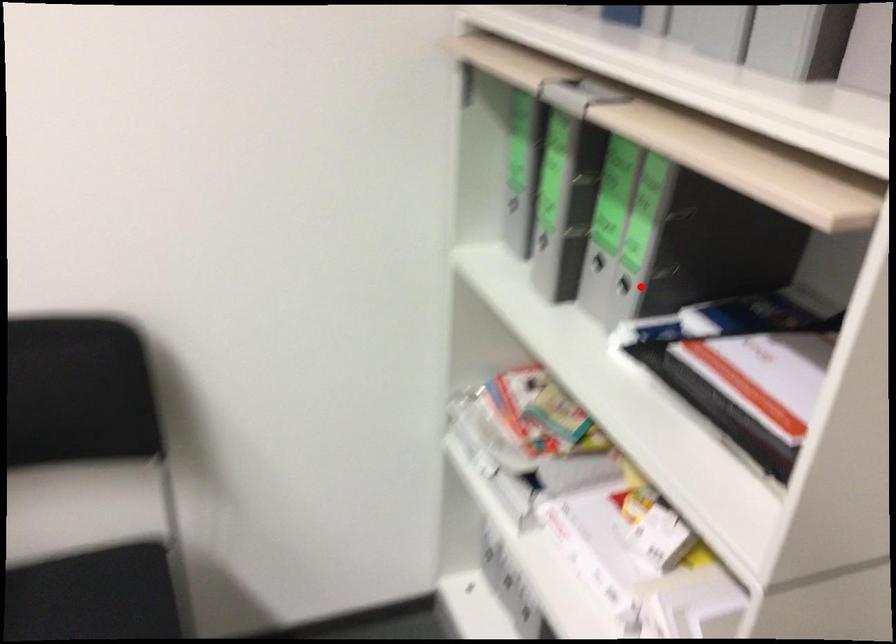
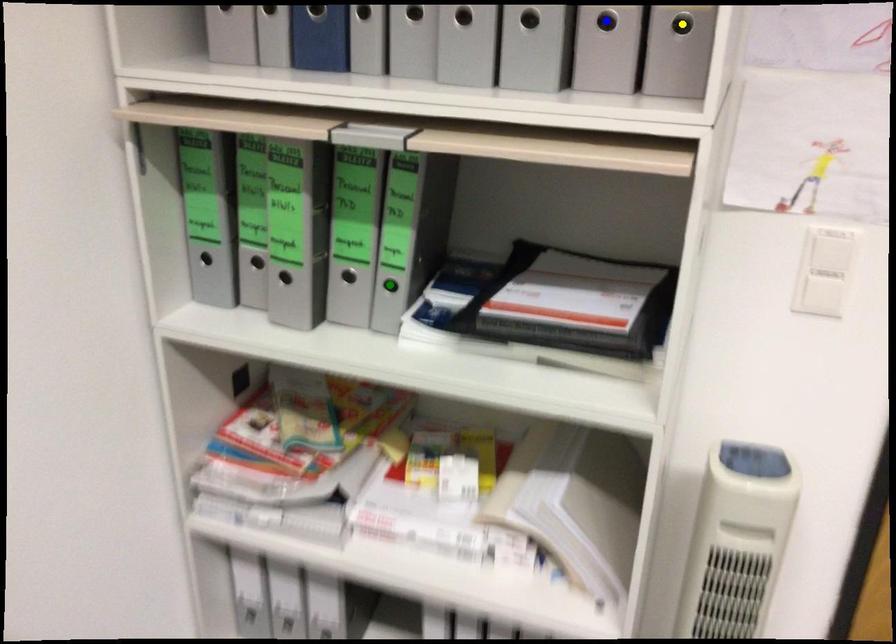
Question: I am providing you with two images of the same scene from different viewpoints. A red point is marked on the first image. You are given multiple points on the second image. Which spot in image 2 lines up with the point in image 1?

Choices:
 (A) blue point
 (B) yellow point
 (C) green point

Answer: (C)